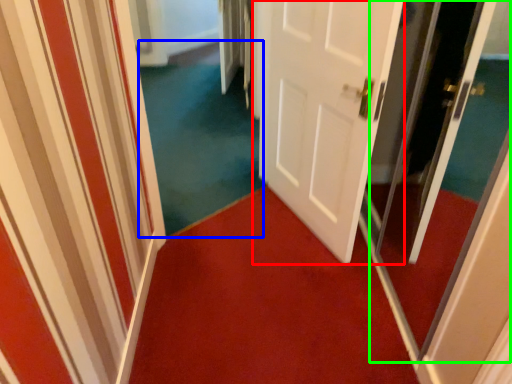
Question: Which object is positioned closest to door (highlighted by a red box)? Select from plain (highlighted by a blue box) and screen door (highlighted by a green box).

Choices:
 (A) plain
 (B) screen door

Answer: (B)